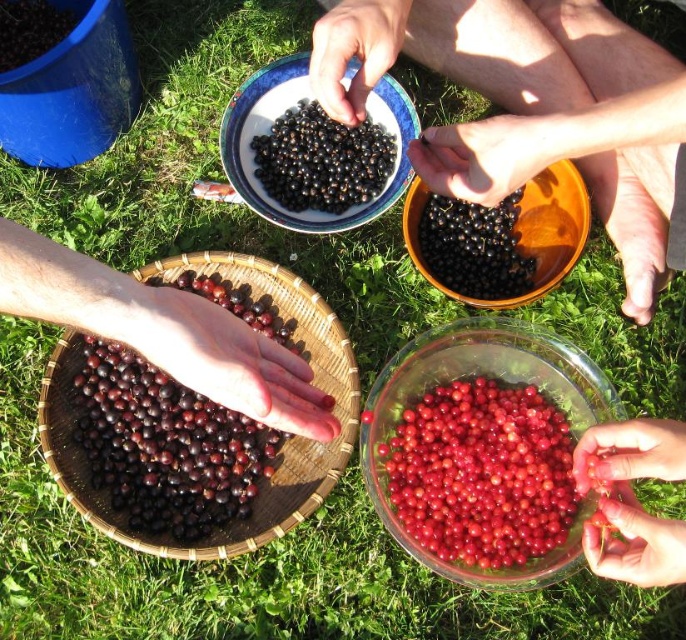
You are a berry picker who wants to place a new basket between the matte ceramic bowl at center and the glossy red currant at lower right. Based on their positions, where should you place the new basket?

The matte ceramic bowl at center is positioned on the left side of glossy red currant at lower right, so you should place the new basket between them on the right side of the matte ceramic bowl at center and the left side of the glossy red currant at lower right.

You are standing at the point where the person is sitting and looking towards the bowls and baskets. Which of the two points, point (272, 131) or point (458, 285), is closer to you?

Point (458, 285) is closer to you because it is in front of point (272, 131) according to the spatial relationship provided.